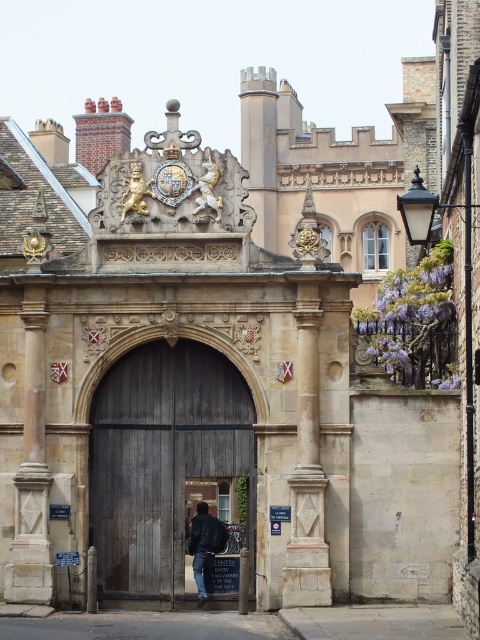
You are a visitor approaching the entrance gate. You see the wooden gate at center and the dark blue jacket at center. Which object is higher from the ground?

The wooden gate at center is above the dark blue jacket at center, so the wooden gate at center is higher from the ground.

You are a visitor at the entrance gate and want to take a photo that includes both the purple wisteria at upper right and the dark blue jacket at center. Based on their positions, where should you position yourself to ensure both are in the frame?

You should position yourself to the left of the dark blue jacket at center so that the purple wisteria at upper right, which is to the right of the dark blue jacket at center, remains within the camera frame.

You are a visitor approaching the historic entrance gate. You notice the wooden gate at center and the purple wisteria at upper right. From your perspective, which object is closer to you?

The wooden gate at center is closer to you because the purple wisteria at upper right is behind it.